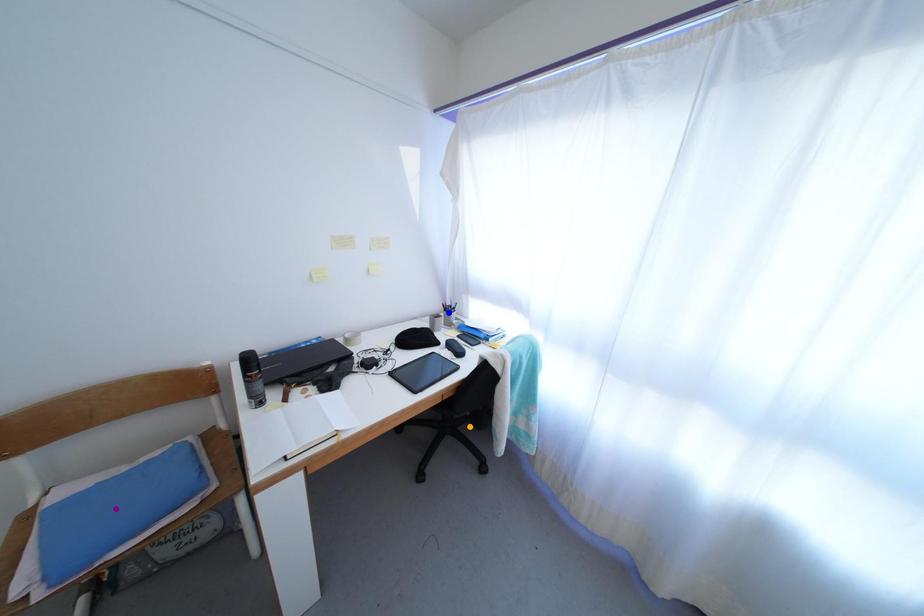
Order these from nearest to farthest:
- blue point
- purple point
- orange point

1. purple point
2. orange point
3. blue point